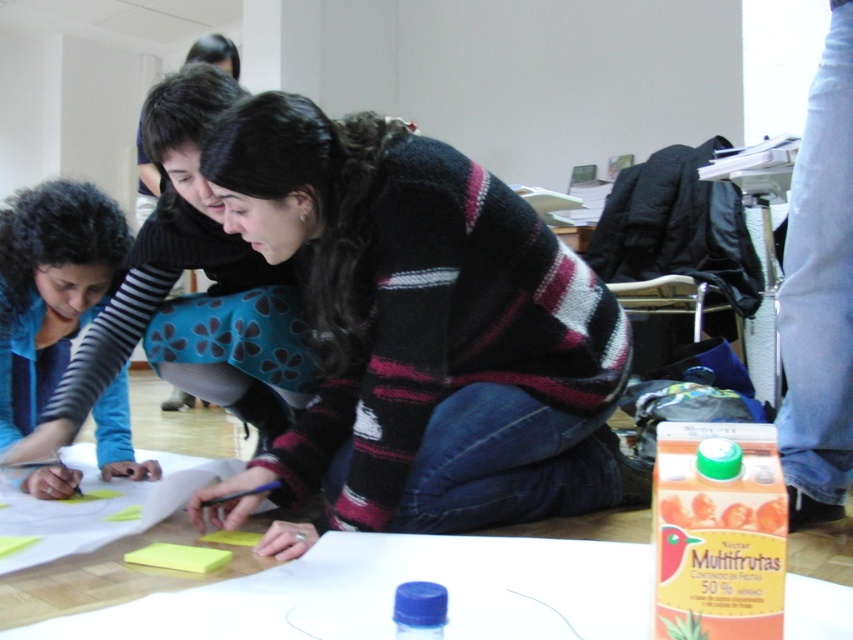
Identify the location of white paper at center. This screenshot has width=853, height=640. (392, 588).

Between white paper at center and yellow paper at center, which one appears on the right side from the viewer's perspective?

white paper at center

Who is more distant from viewer, (630, 572) or (122, 525)?

Positioned behind is point (122, 525).

This screenshot has width=853, height=640. I want to click on white paper at center, so [x=392, y=588].

Is knitted sweater at center further to camera compared to yellow paper at center?

No.

Does knitted sweater at center appear on the right side of yellow paper at center?

Correct, you'll find knitted sweater at center to the right of yellow paper at center.

Measure the distance between point (412, 420) and camera.

Point (412, 420) is 1.28 meters away from camera.

Find the location of `knitted sweater at center`. knitted sweater at center is located at coordinates 419,330.

Between knitted sweater at center and blue fabric shirt at lower left, which one appears on the right side from the viewer's perspective?

Positioned to the right is knitted sweater at center.

Who is positioned more to the left, knitted sweater at center or blue fabric shirt at lower left?

From the viewer's perspective, blue fabric shirt at lower left appears more on the left side.

Describe the element at coordinates (419, 330) in the screenshot. I see `knitted sweater at center` at that location.

Locate an element on the screen. This screenshot has width=853, height=640. knitted sweater at center is located at coordinates (419, 330).